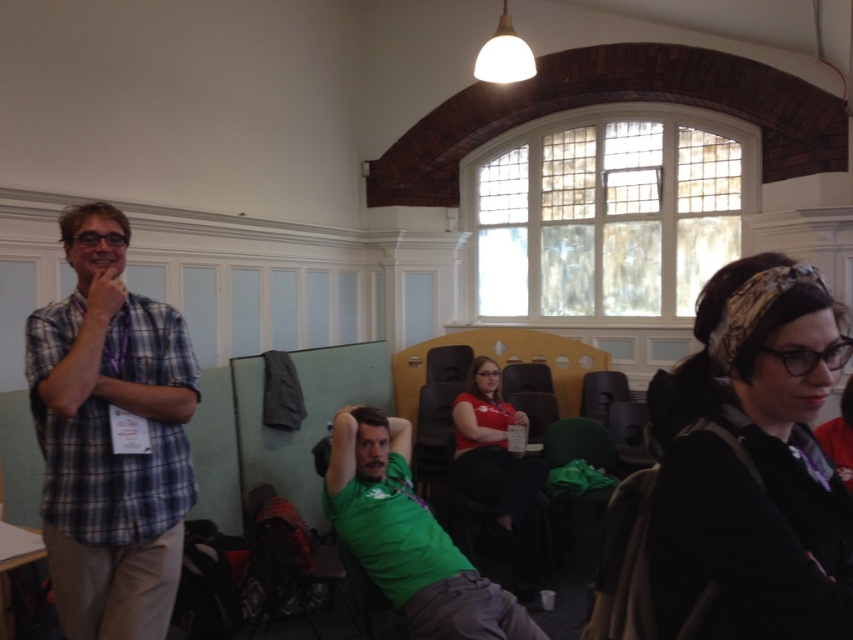
Question: Based on their relative distances, which object is farther from the black fabric headband at upper right?

Choices:
 (A) matte black chair at center
 (B) green matte shirt at center
 (C) matte red shirt at center
 (D) plaid shirt at left

Answer: (A)

Question: Which object appears closest to the camera in this image?

Choices:
 (A) matte red shirt at center
 (B) black fabric headband at upper right
 (C) plaid shirt at left

Answer: (B)

Question: Is black fabric headband at upper right closer to camera compared to matte black chair at center?

Choices:
 (A) yes
 (B) no

Answer: (A)

Question: Where is black fabric headband at upper right located in relation to plaid shirt at left in the image?

Choices:
 (A) left
 (B) right

Answer: (B)

Question: In this image, where is black fabric headband at upper right located relative to green matte shirt at center?

Choices:
 (A) right
 (B) left

Answer: (A)

Question: Which point is closer to the camera taking this photo?

Choices:
 (A) (108, 563)
 (B) (531, 476)
 (C) (625, 390)
 (D) (763, 548)

Answer: (D)